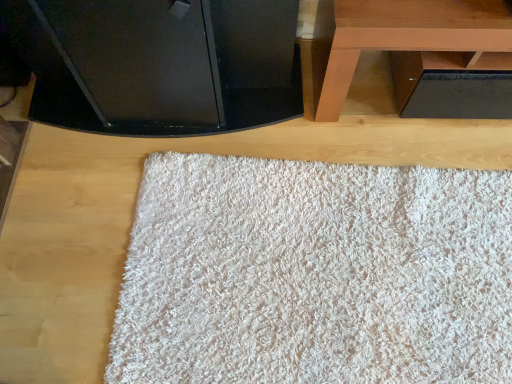
Question: Can you confirm if brown wooden table at upper right is shorter than black glossy tv at upper center?

Choices:
 (A) yes
 (B) no

Answer: (A)

Question: Is brown wooden table at upper right turned away from black glossy tv at upper center?

Choices:
 (A) yes
 (B) no

Answer: (B)

Question: Can black glossy tv at upper center be found inside brown wooden table at upper right?

Choices:
 (A) yes
 (B) no

Answer: (B)

Question: From the image's perspective, does brown wooden table at upper right appear higher than black glossy tv at upper center?

Choices:
 (A) yes
 (B) no

Answer: (A)

Question: Is brown wooden table at upper right outside black glossy tv at upper center?

Choices:
 (A) no
 (B) yes

Answer: (B)

Question: Is black glossy tv at upper center spatially inside brown wooden table at upper right, or outside of it?

Choices:
 (A) inside
 (B) outside

Answer: (B)

Question: From a real-world perspective, is black glossy tv at upper center above or below brown wooden table at upper right?

Choices:
 (A) above
 (B) below

Answer: (A)

Question: Is black glossy tv at upper center wider or thinner than brown wooden table at upper right?

Choices:
 (A) wide
 (B) thin

Answer: (A)

Question: Considering the positions of point (275, 0) and point (431, 28), is point (275, 0) closer or farther from the camera than point (431, 28)?

Choices:
 (A) farther
 (B) closer

Answer: (A)

Question: Considering the positions of point (328, 379) and point (322, 66), is point (328, 379) closer or farther from the camera than point (322, 66)?

Choices:
 (A) farther
 (B) closer

Answer: (B)

Question: From the image's perspective, relative to brown wooden table at upper right, is white fluffy rug at center above or below?

Choices:
 (A) above
 (B) below

Answer: (B)

Question: Considering the relative positions of white fluffy rug at center and brown wooden table at upper right in the image provided, is white fluffy rug at center to the left or to the right of brown wooden table at upper right?

Choices:
 (A) left
 (B) right

Answer: (A)

Question: Is white fluffy rug at center spatially inside brown wooden table at upper right, or outside of it?

Choices:
 (A) outside
 (B) inside

Answer: (A)

Question: Is brown wooden table at upper right to the left or to the right of black glossy tv at upper center in the image?

Choices:
 (A) right
 (B) left

Answer: (A)

Question: Is brown wooden table at upper right inside or outside of black glossy tv at upper center?

Choices:
 (A) outside
 (B) inside

Answer: (A)